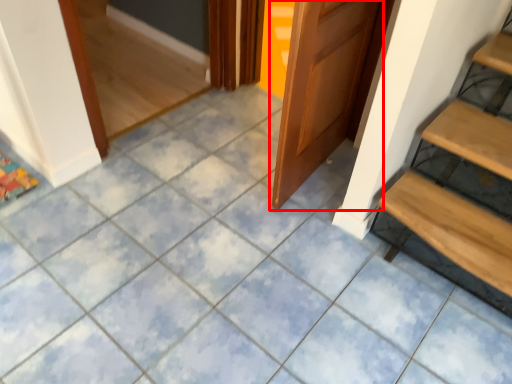
Question: From the image, what is the correct spatial relationship of door (annotated by the red box) in relation to stairs?

Choices:
 (A) right
 (B) left

Answer: (B)